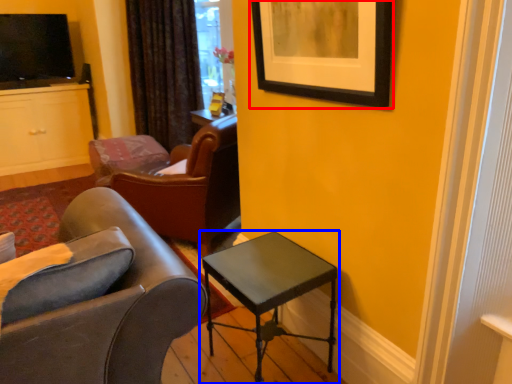
Question: Which of the following is the closest to the observer, picture frame (highlighted by a red box) or table (highlighted by a blue box)?

Choices:
 (A) picture frame
 (B) table

Answer: (A)